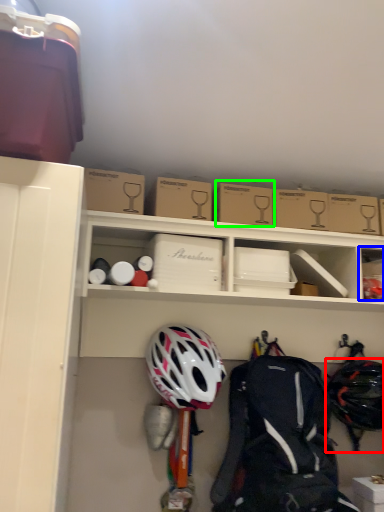
Question: Which is farther away from helmet (highlighted by a red box)? storage box (highlighted by a blue box) or cardboard box (highlighted by a green box)?

Choices:
 (A) storage box
 (B) cardboard box

Answer: (B)